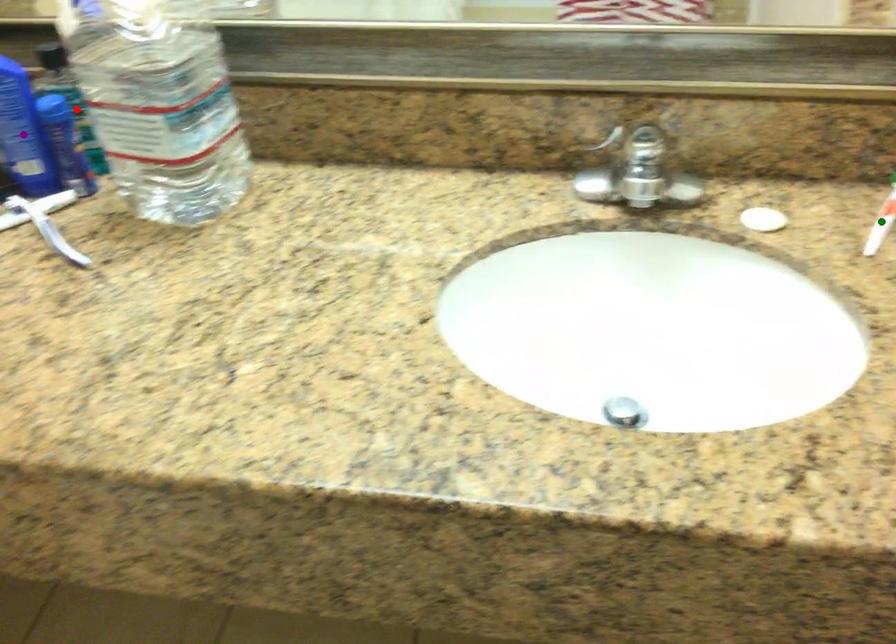
Order these from nearest to farthest:
A) purple point
B) red point
C) green point

red point, purple point, green point